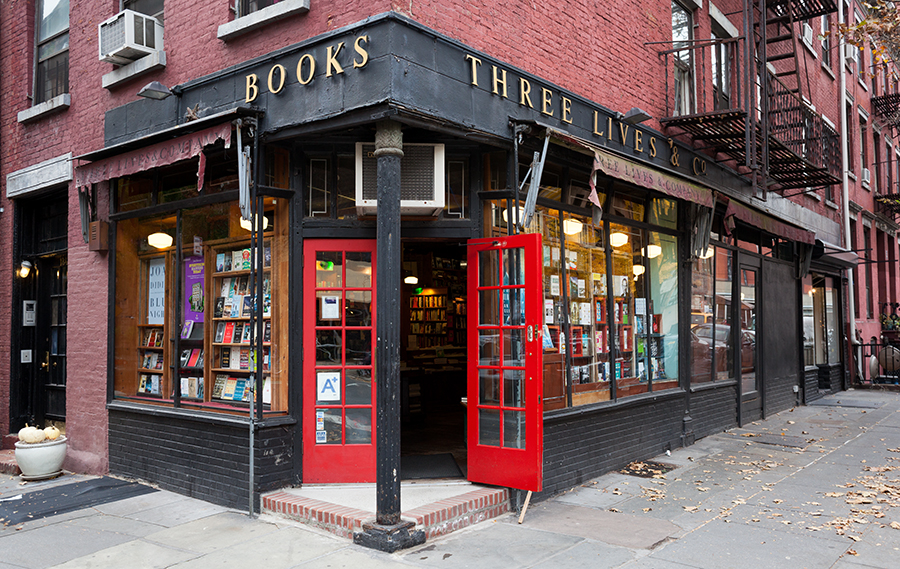
The height and width of the screenshot is (569, 900). I want to click on windows on right side, so click(x=40, y=24), click(x=148, y=5), click(x=241, y=8).